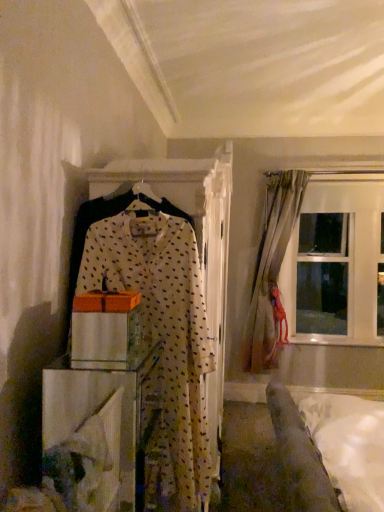
Question: Is white sheer with polka dots at center not inside light beige fabric curtain at right?

Choices:
 (A) no
 (B) yes

Answer: (B)

Question: Is white sheer with polka dots at center positioned before light beige fabric curtain at right?

Choices:
 (A) yes
 (B) no

Answer: (A)

Question: Is white sheer with polka dots at center at the left side of light beige fabric curtain at right?

Choices:
 (A) yes
 (B) no

Answer: (A)

Question: Can you confirm if white sheer with polka dots at center is wider than light beige fabric curtain at right?

Choices:
 (A) no
 (B) yes

Answer: (A)

Question: Does white sheer with polka dots at center appear on the right side of light beige fabric curtain at right?

Choices:
 (A) yes
 (B) no

Answer: (B)

Question: From the image's perspective, is light beige fabric curtain at right located above or below white soft bed at lower right?

Choices:
 (A) above
 (B) below

Answer: (A)

Question: From a real-world perspective, relative to white soft bed at lower right, is light beige fabric curtain at right vertically above or below?

Choices:
 (A) below
 (B) above

Answer: (B)

Question: In the image, is light beige fabric curtain at right on the left side or the right side of white soft bed at lower right?

Choices:
 (A) left
 (B) right

Answer: (A)

Question: Choose the correct answer: Is light beige fabric curtain at right inside white soft bed at lower right or outside it?

Choices:
 (A) outside
 (B) inside

Answer: (A)

Question: Is wooden box at center in front of or behind transparent glass window at upper right in the image?

Choices:
 (A) front
 (B) behind

Answer: (A)

Question: Is wooden box at center bigger or smaller than transparent glass window at upper right?

Choices:
 (A) small
 (B) big

Answer: (A)

Question: Considering the positions of point (91, 376) and point (359, 233), is point (91, 376) closer or farther from the camera than point (359, 233)?

Choices:
 (A) closer
 (B) farther

Answer: (A)

Question: From the image's perspective, is wooden box at center above or below transparent glass window at upper right?

Choices:
 (A) above
 (B) below

Answer: (B)

Question: Considering the positions of point (173, 431) and point (329, 339), is point (173, 431) closer or farther from the camera than point (329, 339)?

Choices:
 (A) closer
 (B) farther

Answer: (A)

Question: From a real-world perspective, is white sheer with polka dots at center above or below transparent glass window at upper right?

Choices:
 (A) above
 (B) below

Answer: (B)